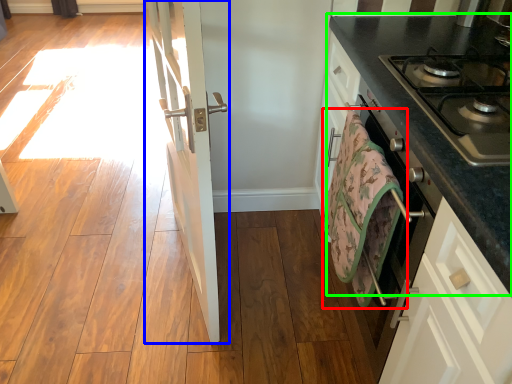
Question: Considering the real-world distances, which object is closest to beach towel (highlighted by a red box)? door (highlighted by a blue box) or countertop (highlighted by a green box).

Choices:
 (A) door
 (B) countertop

Answer: (B)